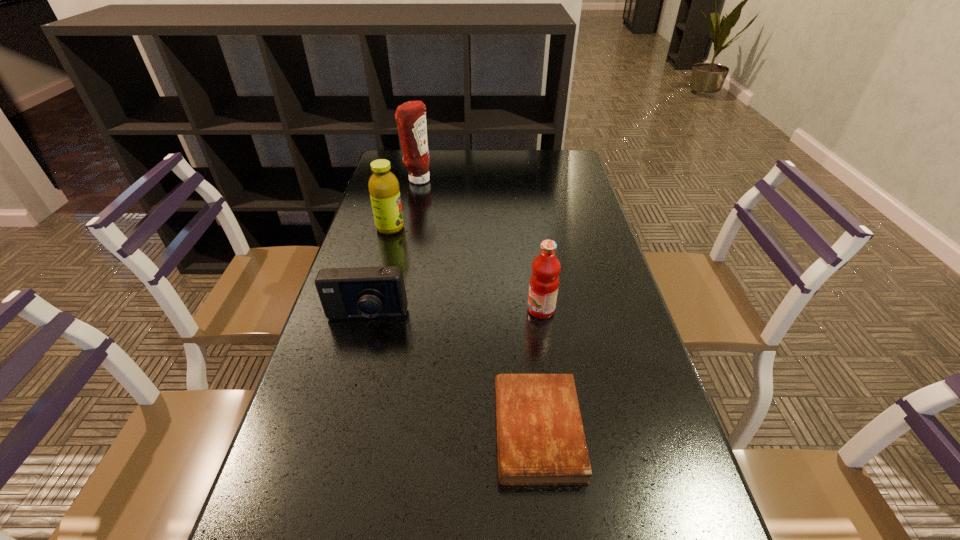
At what (x,y) coordinates should I click in order to perform the action: click on camera at the left edge. Please return your answer as a coordinate pair (x, y). The height and width of the screenshot is (540, 960). Looking at the image, I should click on (364, 292).

Locate an element on the screen. Image resolution: width=960 pixels, height=540 pixels. object at the far left corner is located at coordinates (411, 116).

This screenshot has width=960, height=540. I want to click on vacant space at the far edge of the desktop, so click(495, 177).

I want to click on free region at the left edge, so click(x=380, y=247).

Where is `free space at the right edge of the desktop`? free space at the right edge of the desktop is located at coordinates (573, 248).

The height and width of the screenshot is (540, 960). Find the location of `free spot at the far right corner of the desktop`. free spot at the far right corner of the desktop is located at coordinates (555, 153).

Where is `free point between the shortest object and the fourth tallest object`? Image resolution: width=960 pixels, height=540 pixels. free point between the shortest object and the fourth tallest object is located at coordinates (452, 374).

In order to click on free space between the right fruit juice and the fourth tallest object in this screenshot , I will do `click(454, 314)`.

Identify the location of vacant space that is in between the Bible and the camera. The height and width of the screenshot is (540, 960). (452, 374).

At what (x,y) coordinates should I click in order to perform the action: click on empty space that is in between the right fruit juice and the second shortest object. Please return your answer as a coordinate pair (x, y). The width and height of the screenshot is (960, 540). Looking at the image, I should click on (454, 314).